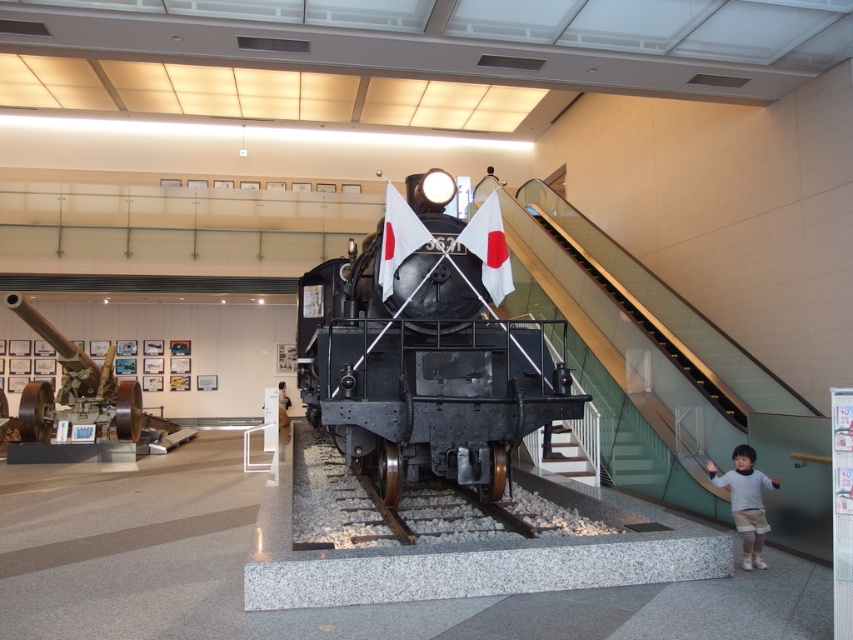
Question: Among these objects, which one is farthest from the camera?

Choices:
 (A) shiny black cannon at left
 (B) clear glass stairs at center
 (C) gray metallic train track at center
 (D) polished black locomotive at center

Answer: (A)

Question: Which point appears closest to the camera in this image?

Choices:
 (A) (524, 529)
 (B) (33, 419)
 (C) (757, 554)
 (D) (618, 300)

Answer: (C)

Question: Is shiny black cannon at left above light gray sweater at lower right?

Choices:
 (A) no
 (B) yes

Answer: (B)

Question: Which object is closer to the camera taking this photo?

Choices:
 (A) polished black locomotive at center
 (B) clear glass stairs at center
 (C) gray metallic train track at center
 (D) light gray sweater at lower right

Answer: (A)

Question: Can you confirm if polished black locomotive at center is wider than shiny black cannon at left?

Choices:
 (A) no
 (B) yes

Answer: (B)

Question: Can you confirm if shiny black cannon at left is bigger than metallic stair at center?

Choices:
 (A) yes
 (B) no

Answer: (A)